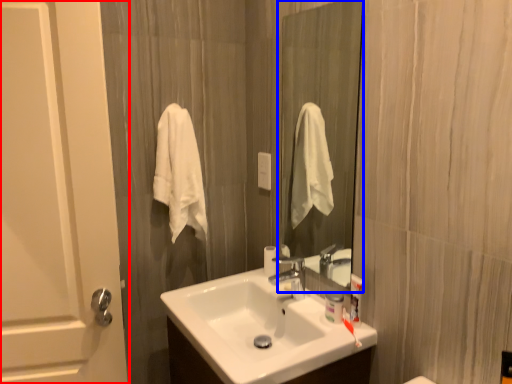
Question: Which object appears farthest to the camera in this image, door (highlighted by a red box) or mirror (highlighted by a blue box)?

Choices:
 (A) door
 (B) mirror

Answer: (B)